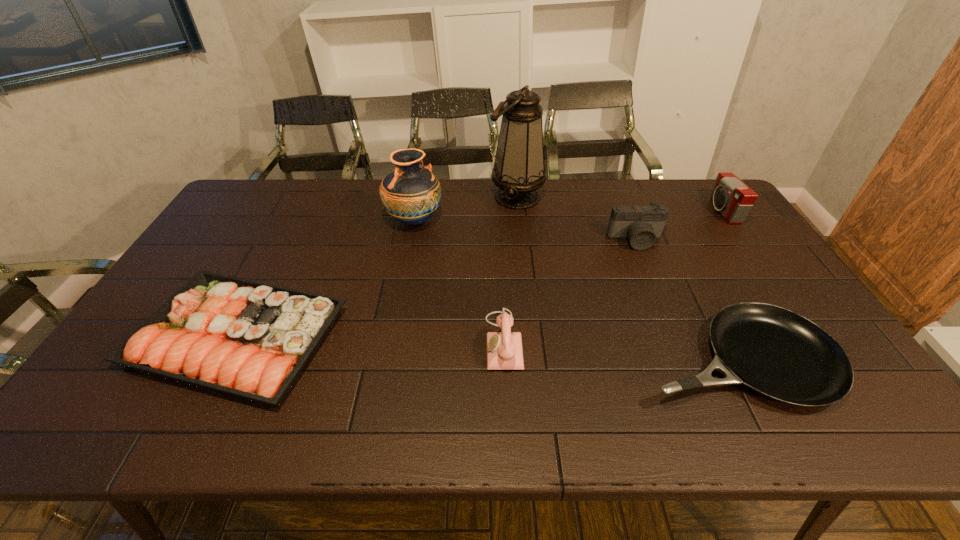
The height and width of the screenshot is (540, 960). Identify the location of pottery at the far edge. (411, 194).

Image resolution: width=960 pixels, height=540 pixels. In order to click on camera at the far edge in this screenshot , I will do `click(731, 197)`.

Image resolution: width=960 pixels, height=540 pixels. I want to click on pan positioned at the near edge, so click(773, 351).

What are the coordinates of `platter at the near edge` in the screenshot? It's located at (250, 340).

I want to click on object present at the left edge, so click(x=250, y=340).

I want to click on camera located at the right edge, so click(731, 197).

Find the location of `pan that is at the right edge`. pan that is at the right edge is located at coordinates (773, 351).

The height and width of the screenshot is (540, 960). In order to click on object that is at the near left corner in this screenshot , I will do `click(250, 340)`.

Find the location of a particular element. object at the far right corner is located at coordinates (731, 197).

This screenshot has width=960, height=540. I want to click on object at the near right corner, so click(773, 351).